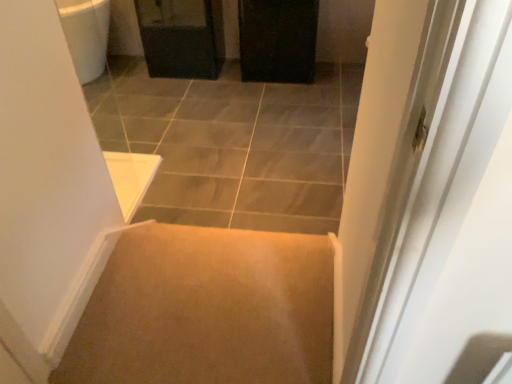
This screenshot has height=384, width=512. I want to click on black matte cabinet at upper center, so pos(278,40).

You are a GUI agent. You are given a task and a screenshot of the screen. Output one action in this format:
    pyautogui.click(x=<x>, y=<y>)
    Task: Click on the carpet at center
    
    Given the screenshot: What is the action you would take?
    pyautogui.click(x=234, y=144)

Identify the location of matte black cabinet at upper center. The width and height of the screenshot is (512, 384). (182, 37).

Identify the location of black matte cabinet at upper center. (278, 40).

Where is `cabinetry that is above the carpet at center (from a real-world perspective)`? Image resolution: width=512 pixels, height=384 pixels. cabinetry that is above the carpet at center (from a real-world perspective) is located at coordinates (182, 37).

Can you confirm if carpet at center is shorter than matte black cabinet at upper center?

Correct, carpet at center is not as tall as matte black cabinet at upper center.

How different are the orientations of carpet at center and matte black cabinet at upper center in degrees?

0.811 degrees.

From a real-world perspective, between matte black cabinet at upper center and black matte cabinet at upper center, who is vertically lower?

In real-world perspective, matte black cabinet at upper center is lower.

Which object is further away from the camera taking this photo, matte black cabinet at upper center or black matte cabinet at upper center?

matte black cabinet at upper center is further from the camera.

Who is taller, matte black cabinet at upper center or black matte cabinet at upper center?

With more height is black matte cabinet at upper center.

Is matte black cabinet at upper center turned away from black matte cabinet at upper center?

No, matte black cabinet at upper center is not facing away from black matte cabinet at upper center.

Can you tell me how much matte black cabinet at upper center and carpet at center differ in facing direction?

There is a 0.811-degree angle between the facing directions of matte black cabinet at upper center and carpet at center.

Does point (219, 5) appear closer or farther from the camera than point (163, 141)?

Point (219, 5) is positioned farther from the camera compared to point (163, 141).

Is matte black cabinet at upper center further to camera compared to carpet at center?

Yes, it is behind carpet at center.

Considering the relative sizes of black matte cabinet at upper center and matte black cabinet at upper center in the image provided, is black matte cabinet at upper center smaller than matte black cabinet at upper center?

Yes, black matte cabinet at upper center is smaller than matte black cabinet at upper center.

Could matte black cabinet at upper center be considered to be inside black matte cabinet at upper center?

Actually, matte black cabinet at upper center is outside black matte cabinet at upper center.

Measure the distance between black matte cabinet at upper center and matte black cabinet at upper center.

black matte cabinet at upper center and matte black cabinet at upper center are 20.69 inches apart from each other.

Can you tell me how much black matte cabinet at upper center and matte black cabinet at upper center differ in facing direction?

The angle between the facing direction of black matte cabinet at upper center and the facing direction of matte black cabinet at upper center is 0.00329 degrees.

Locate an element on the screen. screen door behind the carpet at center is located at coordinates (278, 40).

Which object is closer to the camera taking this photo, black matte cabinet at upper center or carpet at center?

Positioned in front is carpet at center.

From a real-world perspective, between black matte cabinet at upper center and carpet at center, who is vertically higher?

black matte cabinet at upper center, from a real-world perspective.

In the scene shown: Is carpet at center behind black matte cabinet at upper center?

No, carpet at center is closer to the viewer.

Does carpet at center have a smaller size compared to black matte cabinet at upper center?

No.

Identify the location of path beneath the black matte cabinet at upper center (from a real-world perspective). (234, 144).

Where is `path below the matte black cabinet at upper center (from a real-world perspective)`? path below the matte black cabinet at upper center (from a real-world perspective) is located at coordinates (234, 144).

Image resolution: width=512 pixels, height=384 pixels. Find the location of `screen door above the matte black cabinet at upper center (from a real-world perspective)`. screen door above the matte black cabinet at upper center (from a real-world perspective) is located at coordinates (278, 40).

From the image, which object appears to be nearer to matte black cabinet at upper center, black matte cabinet at upper center or carpet at center?

black matte cabinet at upper center is closer to matte black cabinet at upper center.

Estimate the real-world distances between objects in this image. Which object is further from carpet at center, matte black cabinet at upper center or black matte cabinet at upper center?

matte black cabinet at upper center is positioned further to the anchor carpet at center.

When comparing their distances from carpet at center, does black matte cabinet at upper center or matte black cabinet at upper center seem closer?

black matte cabinet at upper center is positioned closer to the anchor carpet at center.

Based on their spatial positions, is carpet at center or black matte cabinet at upper center closer to matte black cabinet at upper center?

black matte cabinet at upper center is positioned closer to the anchor matte black cabinet at upper center.

Which object lies nearer to the anchor point black matte cabinet at upper center, carpet at center or matte black cabinet at upper center?

matte black cabinet at upper center lies closer to black matte cabinet at upper center than the other object.

Considering their positions, is matte black cabinet at upper center positioned closer to black matte cabinet at upper center than carpet at center?

matte black cabinet at upper center is positioned closer to the anchor black matte cabinet at upper center.

Where is `screen door between carpet at center and matte black cabinet at upper center along the z-axis`? screen door between carpet at center and matte black cabinet at upper center along the z-axis is located at coordinates (278, 40).